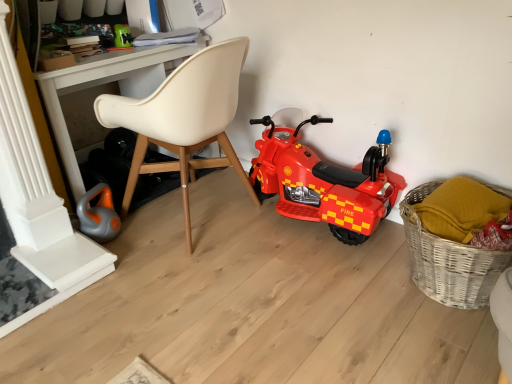
Question: Is orange rubber toy at lower left, the first toy when ordered from front to back, taller or shorter than green plastic toy at upper left, arranged as the first toy when viewed from the back?

Choices:
 (A) short
 (B) tall

Answer: (B)

Question: Considering the positions of orange rubber toy at lower left, arranged as the 2th toy when viewed from the back, and green plastic toy at upper left, which appears as the first toy when viewed from the top, in the image, is orange rubber toy at lower left, arranged as the 2th toy when viewed from the back, wider or thinner than green plastic toy at upper left, which appears as the first toy when viewed from the top,?

Choices:
 (A) thin
 (B) wide

Answer: (B)

Question: Which object is positioned farthest from the woven wicker basket at lower right?

Choices:
 (A) orange rubber toy at lower left, positioned as the second toy in top-to-bottom order
 (B) green plastic toy at upper left, which appears as the first toy when viewed from the top
 (C) white plastic desk at upper center
 (D) red plastic toy motorcycle at center
 (E) beige leather chair at center

Answer: (B)

Question: Which is farther from the woven wicker basket at lower right?

Choices:
 (A) green plastic toy at upper left, the 2th toy ordered from the bottom
 (B) orange rubber toy at lower left, which is the 1th toy in bottom-to-top order
 (C) beige leather chair at center
 (D) white plastic desk at upper center
 (E) red plastic toy motorcycle at center

Answer: (A)